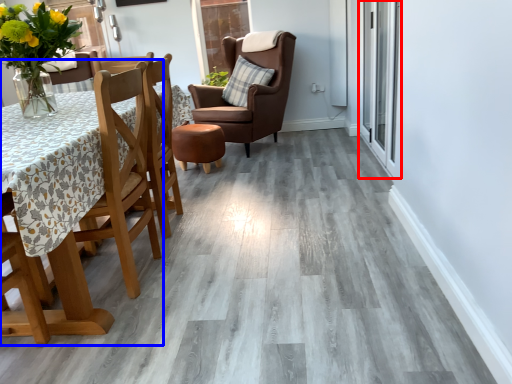
Question: Which of the following is the farthest to the observer, glass door (highlighted by a red box) or chair (highlighted by a blue box)?

Choices:
 (A) glass door
 (B) chair

Answer: (A)